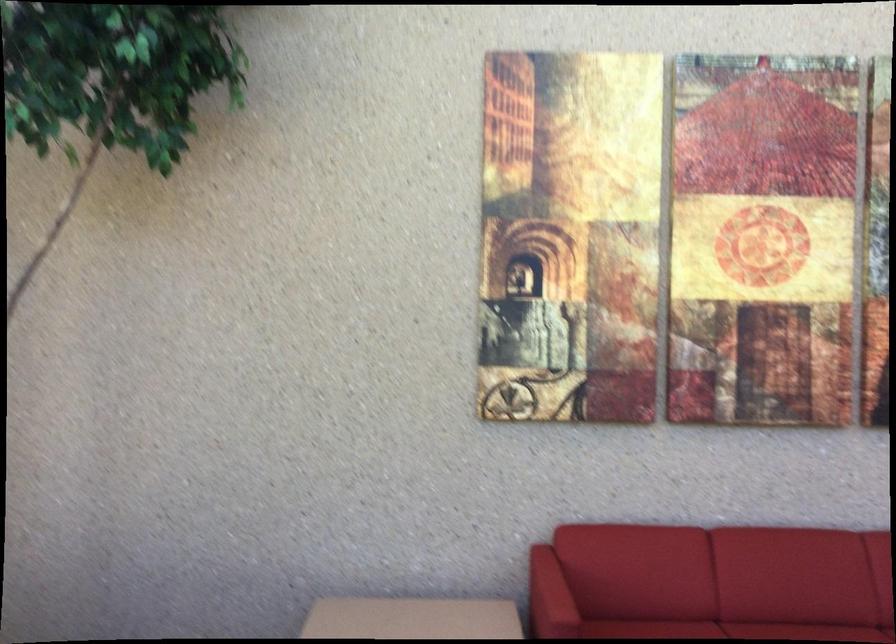
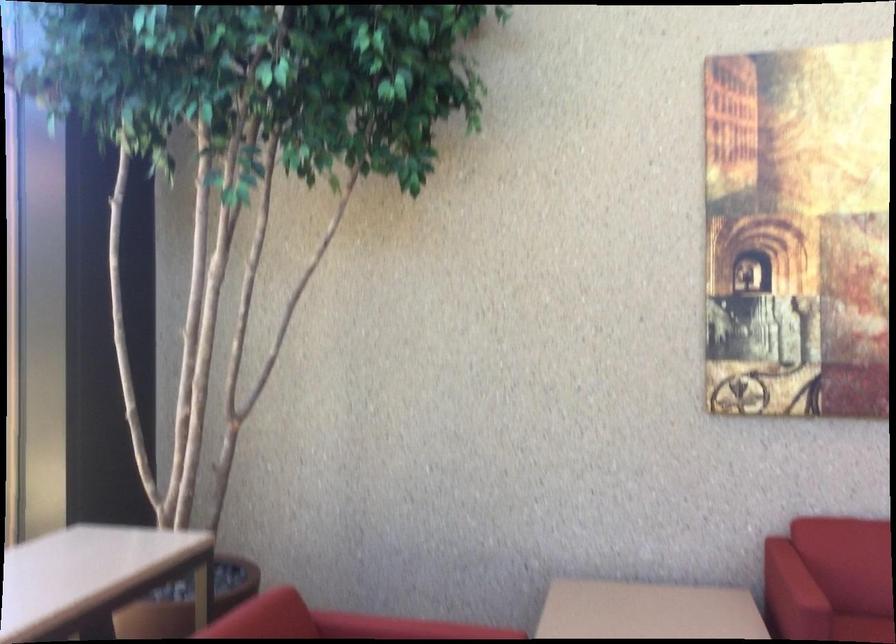
In a continuous first-person perspective shot, in which direction is the camera moving?

The movement direction of the cameraman is left, backward.